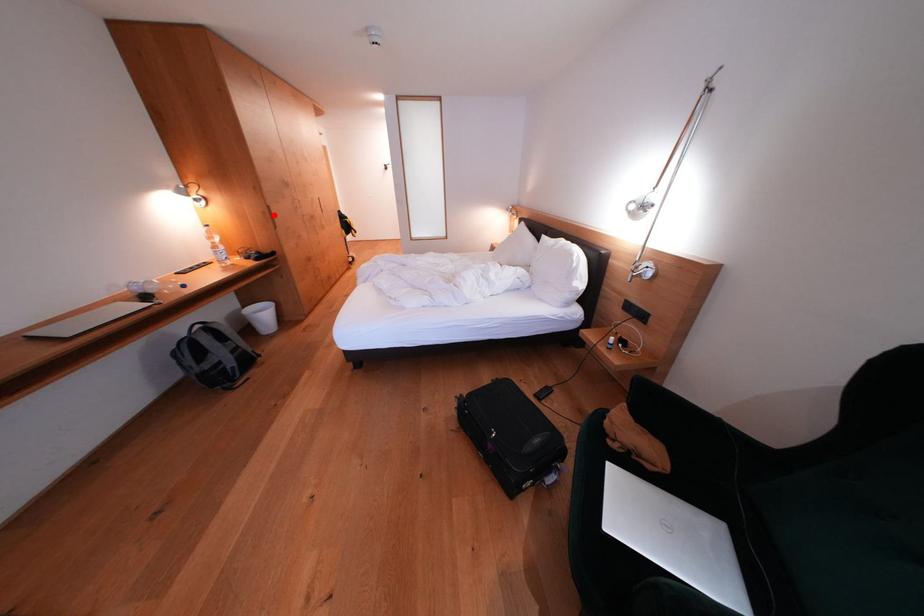
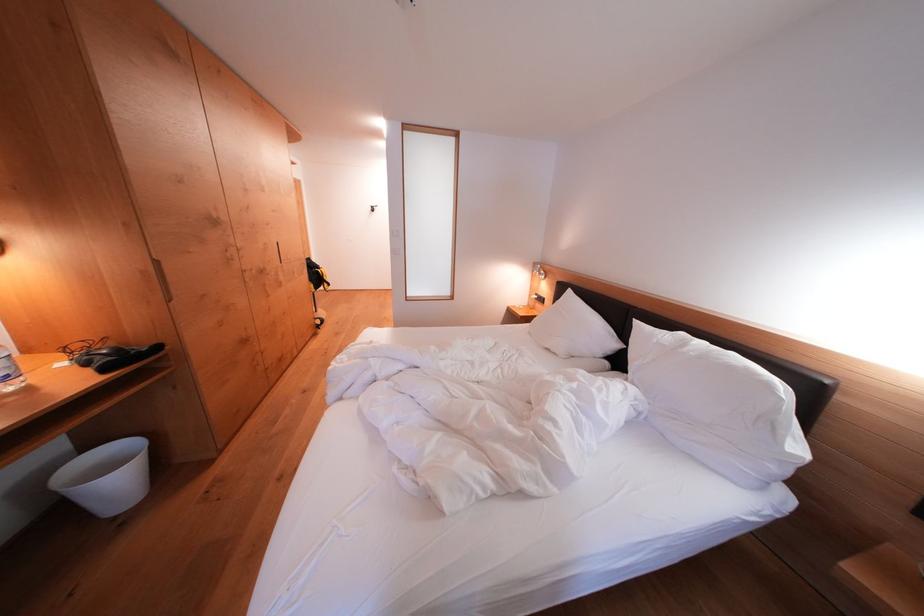
Where in the second image is the point corresponding to the highlighted location from the first image?

(159, 274)